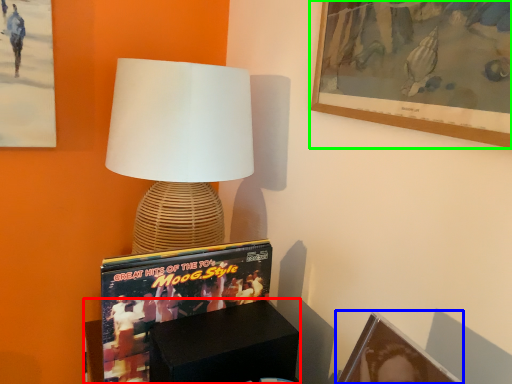
Question: Based on their relative distances, which object is nearer to furniture (highlighted by a red box)? Choose from picture frame (highlighted by a blue box) and picture frame (highlighted by a green box).

Choices:
 (A) picture frame
 (B) picture frame

Answer: (A)